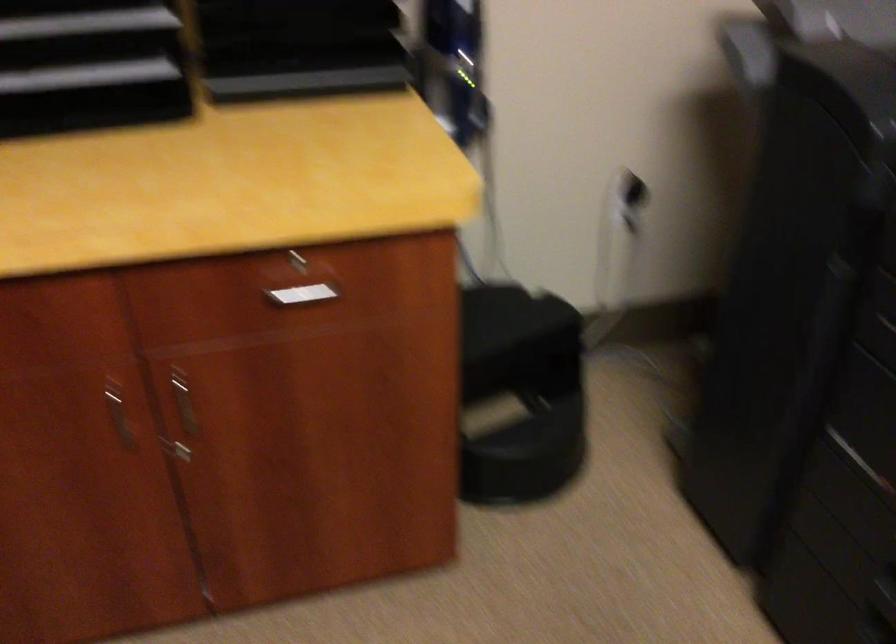
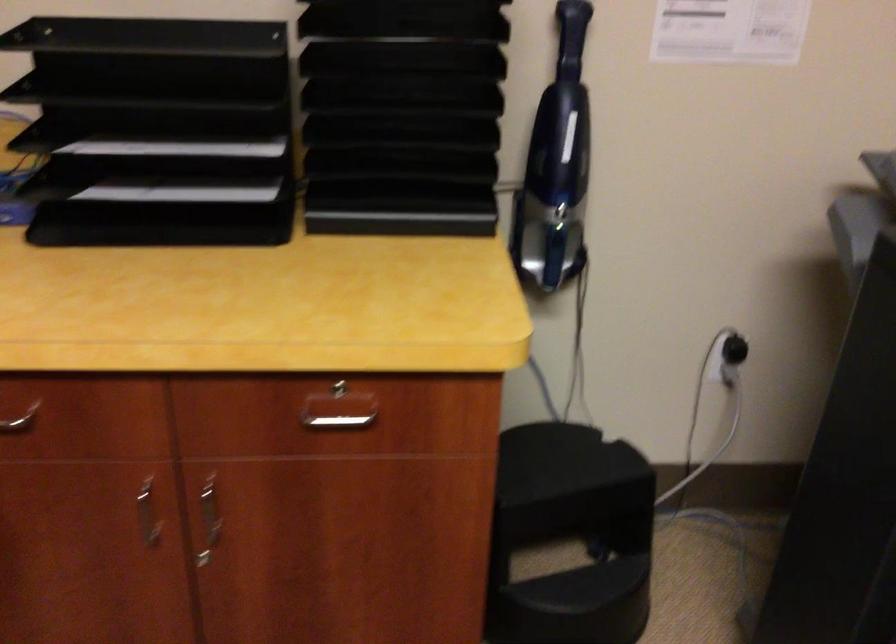
The point at (115,415) is marked in the first image. Where is the corresponding point in the second image?

(148, 514)